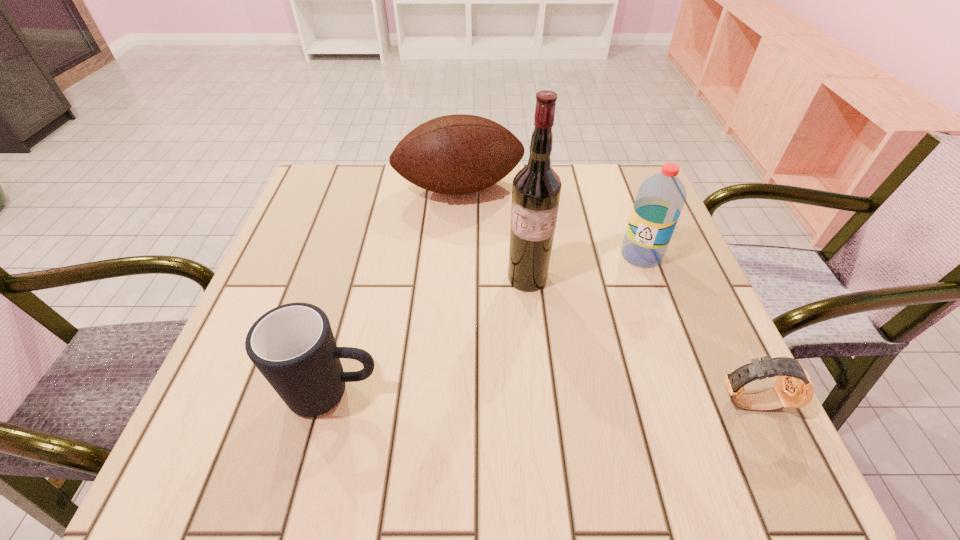
Find the location of a particular element. free space located on the front label of the water bottle is located at coordinates (612, 286).

This screenshot has height=540, width=960. Identify the location of vacant space situated 0.240m on the front label of the water bottle. (568, 332).

Where is `free location located 0.270m on the laces of the farthest object`? The image size is (960, 540). free location located 0.270m on the laces of the farthest object is located at coordinates (498, 292).

At what (x,y) coordinates should I click in order to perform the action: click on free point located on the laces of the farthest object. Please return your answer as a coordinate pair (x, y). The width and height of the screenshot is (960, 540). Looking at the image, I should click on (486, 253).

Identify the location of vacant area situated on the laces of the farthest object. The height and width of the screenshot is (540, 960). (512, 335).

What are the coordinates of `object at the far edge` in the screenshot? It's located at (455, 154).

Find the location of `mug located at the near edge`. mug located at the near edge is located at coordinates (292, 345).

The width and height of the screenshot is (960, 540). In order to click on watch that is at the near edge in this screenshot , I will do `click(794, 388)`.

The height and width of the screenshot is (540, 960). Find the location of `object at the left edge`. object at the left edge is located at coordinates (292, 345).

Locate an element on the screen. watch present at the right edge is located at coordinates (794, 388).